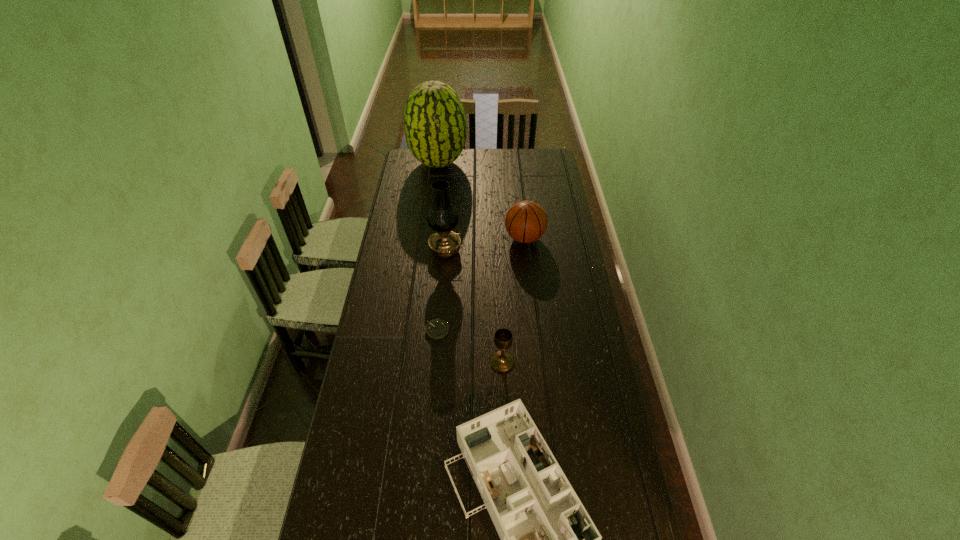
Where is `free space at the far right corner`? This screenshot has height=540, width=960. free space at the far right corner is located at coordinates (548, 158).

The image size is (960, 540). In order to click on vacant space that is in between the oil lamp and the third tallest object in this screenshot , I will do pyautogui.click(x=485, y=245).

I want to click on free space that is in between the fifth farthest object and the third nearest object, so click(x=469, y=346).

The height and width of the screenshot is (540, 960). Find the location of `free area in between the watermelon and the basketball`. free area in between the watermelon and the basketball is located at coordinates (482, 201).

Locate an element on the screen. This screenshot has width=960, height=540. vacant region between the farthest object and the fifth farthest object is located at coordinates (470, 262).

The image size is (960, 540). I want to click on free area in between the farthest object and the basketball, so click(482, 201).

You are a GUI agent. You are given a task and a screenshot of the screen. Output one action in this format:
    pyautogui.click(x=<x>, y=<y>)
    Task: Click on the free space between the fourth shortest object and the oil lamp
    The height and width of the screenshot is (540, 960).
    Given the screenshot: What is the action you would take?
    pyautogui.click(x=485, y=245)

The width and height of the screenshot is (960, 540). Identify the location of free point between the fifth farthest object and the basketball. (514, 300).

Point out which object is positioned as the second nearest to the fourth farthest object. Please provide its 2D coordinates. Your answer should be formatted as a tuple, i.e. [(x, y)], where the tuple contains the x and y coordinates of a point satisfying the conditions above.

[(548, 539)]

Where is `object that can be found as the third closest to the shortest object`? object that can be found as the third closest to the shortest object is located at coordinates (442, 217).